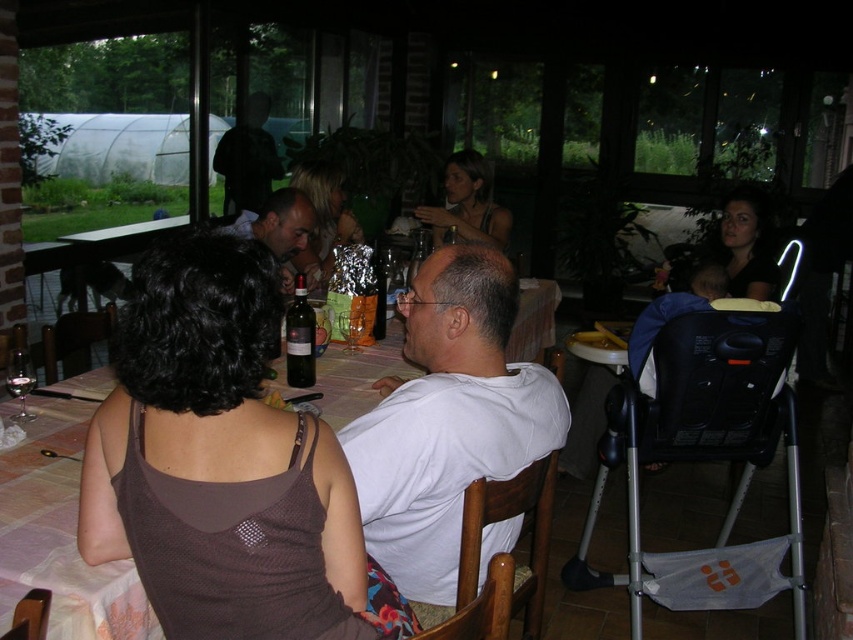
Who is shorter, white cotton shirt at center or shiny silver foil at center?

shiny silver foil at center

Does white cotton shirt at center have a greater height compared to shiny silver foil at center?

Yes, white cotton shirt at center is taller than shiny silver foil at center.

The image size is (853, 640). What are the coordinates of `white cotton shirt at center` in the screenshot? It's located at (448, 419).

Which of these two, white cotton shirt at center or matte brown hair at center, stands shorter?

Standing shorter between the two is matte brown hair at center.

Is white cotton shirt at center in front of matte brown hair at center?

That is True.

Where is `white cotton shirt at center`? white cotton shirt at center is located at coordinates (448, 419).

Can you confirm if matte brown hair at center is positioned above matte black shirt at center?

Yes, matte brown hair at center is above matte black shirt at center.

From the picture: Who is positioned more to the left, matte brown hair at center or matte black shirt at center?

matte black shirt at center

Between point (482, 168) and point (299, 252), which one is positioned in front?

Point (299, 252) is in front.

This screenshot has width=853, height=640. In order to click on matte brown hair at center in this screenshot , I will do `click(467, 204)`.